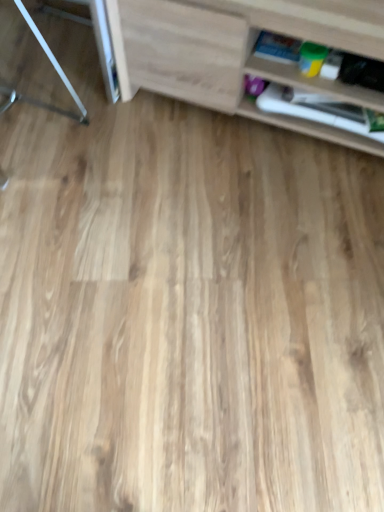
Question: From a real-world perspective, is wooden shelf at right, marked as the second shelf in a front-to-back arrangement, over light wood cabinet at upper right, placed as the 1th shelf when sorted from front to back?

Choices:
 (A) yes
 (B) no

Answer: (B)

Question: From a real-world perspective, is wooden shelf at right, the 1th shelf when ordered from back to front, physically below light wood cabinet at upper right, placed as the 1th shelf when sorted from front to back?

Choices:
 (A) no
 (B) yes

Answer: (B)

Question: Does wooden shelf at right, marked as the second shelf in a front-to-back arrangement, appear on the right side of light wood cabinet at upper right, which appears as the second shelf when viewed from the back?

Choices:
 (A) no
 (B) yes

Answer: (B)

Question: Is wooden shelf at right, the 1th shelf when ordered from back to front, at the left side of light wood cabinet at upper right, placed as the 1th shelf when sorted from front to back?

Choices:
 (A) no
 (B) yes

Answer: (A)

Question: Does wooden shelf at right, marked as the second shelf in a front-to-back arrangement, have a lesser height compared to light wood cabinet at upper right, placed as the 1th shelf when sorted from front to back?

Choices:
 (A) yes
 (B) no

Answer: (A)

Question: From the image's perspective, is wooden shelf at right, marked as the second shelf in a front-to-back arrangement, on light wood cabinet at upper right, placed as the 1th shelf when sorted from front to back?

Choices:
 (A) yes
 (B) no

Answer: (B)

Question: From a real-world perspective, does metallic silver table at left sit lower than light wood cabinet at upper right, which appears as the second shelf when viewed from the back?

Choices:
 (A) no
 (B) yes

Answer: (B)

Question: Is metallic silver table at left at the left side of light wood cabinet at upper right, which appears as the second shelf when viewed from the back?

Choices:
 (A) yes
 (B) no

Answer: (A)

Question: Is metallic silver table at left smaller than light wood cabinet at upper right, placed as the 1th shelf when sorted from front to back?

Choices:
 (A) no
 (B) yes

Answer: (B)

Question: From the image's perspective, is metallic silver table at left below light wood cabinet at upper right, placed as the 1th shelf when sorted from front to back?

Choices:
 (A) no
 (B) yes

Answer: (A)

Question: Is metallic silver table at left not inside light wood cabinet at upper right, placed as the 1th shelf when sorted from front to back?

Choices:
 (A) no
 (B) yes

Answer: (B)

Question: Is metallic silver table at left thinner than light wood cabinet at upper right, placed as the 1th shelf when sorted from front to back?

Choices:
 (A) no
 (B) yes

Answer: (A)

Question: Would you say metallic silver table at left is outside wooden shelf at right, the 1th shelf when ordered from back to front?

Choices:
 (A) yes
 (B) no

Answer: (A)